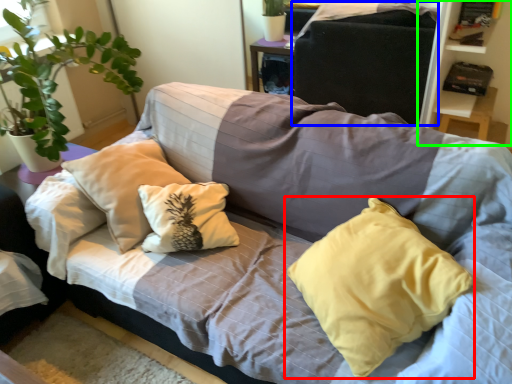
Question: Considering the real-world distances, which object is closest to pillow (highlighted by a red box)? gray (highlighted by a blue box) or bookshelf (highlighted by a green box).

Choices:
 (A) gray
 (B) bookshelf

Answer: (B)